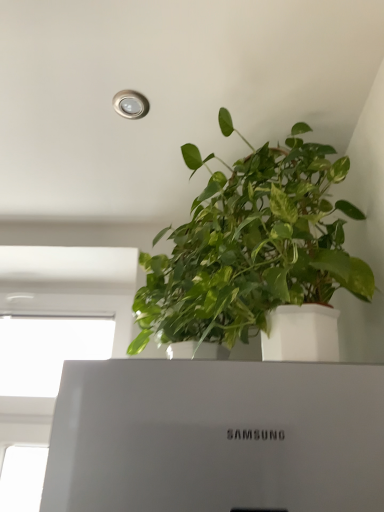
Question: Is green matte plant at upper center a part of white glossy window at lower left?

Choices:
 (A) yes
 (B) no

Answer: (B)

Question: Is the position of white glossy window at lower left more distant than that of green matte plant at upper center?

Choices:
 (A) no
 (B) yes

Answer: (A)

Question: Does white glossy window at lower left turn towards green matte plant at upper center?

Choices:
 (A) no
 (B) yes

Answer: (A)

Question: Considering the relative sizes of white glossy window at lower left and green matte plant at upper center in the image provided, is white glossy window at lower left taller than green matte plant at upper center?

Choices:
 (A) no
 (B) yes

Answer: (A)

Question: Is white glossy window at lower left not close to green matte plant at upper center?

Choices:
 (A) yes
 (B) no

Answer: (B)

Question: Is white glossy window at lower left turned away from green matte plant at upper center?

Choices:
 (A) no
 (B) yes

Answer: (A)

Question: Does green matte plant at upper center come in front of white glossy window at lower left?

Choices:
 (A) no
 (B) yes

Answer: (A)

Question: From the image's perspective, is green matte plant at upper center under white glossy window at lower left?

Choices:
 (A) no
 (B) yes

Answer: (A)

Question: From a real-world perspective, is green matte plant at upper center located higher than white glossy window at lower left?

Choices:
 (A) no
 (B) yes

Answer: (B)

Question: From a real-world perspective, is green matte plant at upper center physically below white glossy window at lower left?

Choices:
 (A) yes
 (B) no

Answer: (B)

Question: Considering the relative sizes of green matte plant at upper center and white glossy window at lower left in the image provided, is green matte plant at upper center smaller than white glossy window at lower left?

Choices:
 (A) yes
 (B) no

Answer: (B)

Question: From the image's perspective, is green matte plant at upper center on top of white glossy window at lower left?

Choices:
 (A) yes
 (B) no

Answer: (A)

Question: From a real-world perspective, is green matte plant at upper center positioned above or below white glossy window at lower left?

Choices:
 (A) above
 (B) below

Answer: (A)